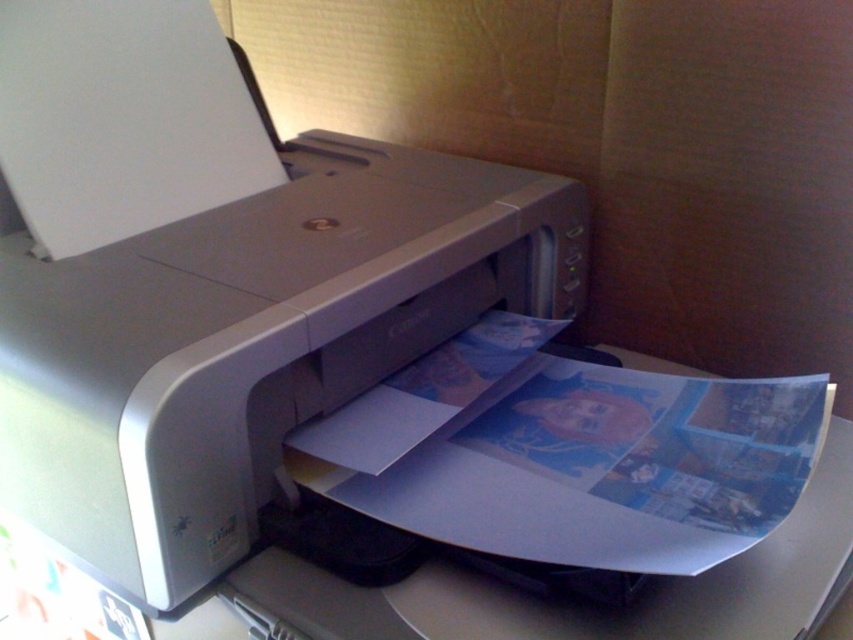
You are standing 36 inches away from a Canon printer that is printing a document with a blue background. There is a point at coordinates point (271, 188). Can you reach this point without moving closer to the printer?

The distance of point (271, 188) from viewer is 30.96 inches, so yes, you can reach it without moving closer since you are already 36 inches away, which is farther than the point.

In the scene shown: You are setting up a new printer and need to ensure it fits on your desk. The desk has limited vertical space. Based on the scene, which object, the satin silver printer at center or the glossy paper at center, is taller?

The satin silver printer at center is much taller than the glossy paper at center, so the printer would require more vertical space on the desk.